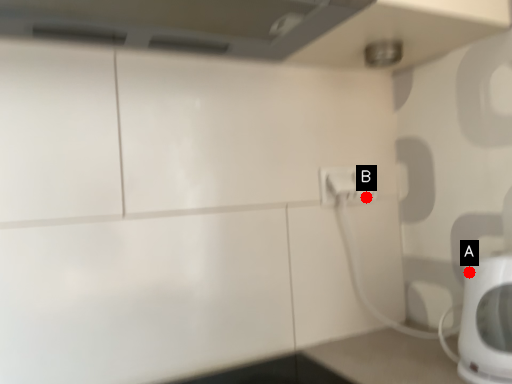
Question: Two points are circled on the image, labeled by A and B beside each circle. Which of the following is the farthest from the observer?

Choices:
 (A) A is further
 (B) B is further

Answer: (B)